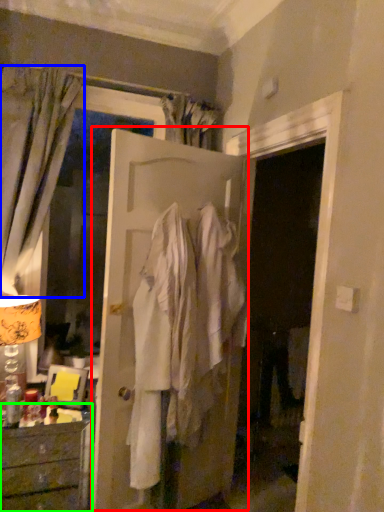
Question: Which object is positioned closest to door (highlighted by a red box)? Select from curtain (highlighted by a blue box) and chest of drawers (highlighted by a green box).

Choices:
 (A) curtain
 (B) chest of drawers

Answer: (A)